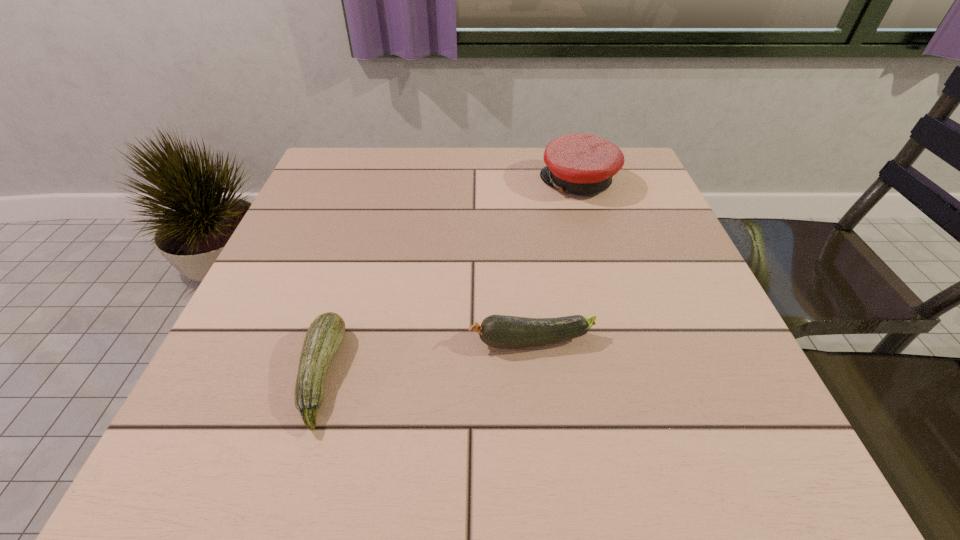
Find the location of `free point between the right zucchini and the leftmost object`. free point between the right zucchini and the leftmost object is located at coordinates (426, 359).

The image size is (960, 540). In order to click on blank region between the cap and the right zucchini in this screenshot , I will do `click(555, 262)`.

This screenshot has width=960, height=540. What are the coordinates of `object that ranks as the closest to the farthest object` in the screenshot? It's located at (500, 331).

Where is `object that is the closest one to the right zucchini`? The height and width of the screenshot is (540, 960). object that is the closest one to the right zucchini is located at coordinates (325, 334).